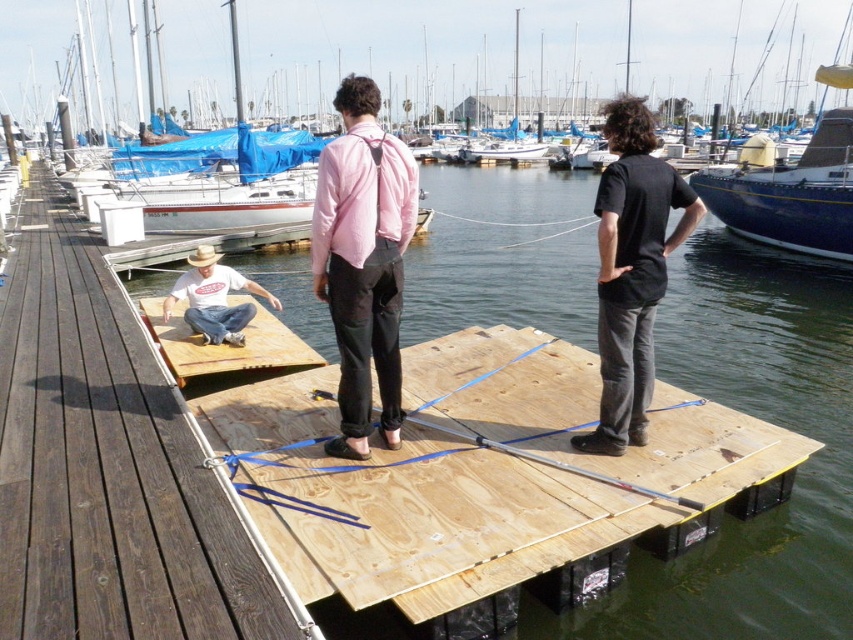
Question: Is blue tarpaulin boat at upper left to the left of wooden ramp at center from the viewer's perspective?

Choices:
 (A) no
 (B) yes

Answer: (B)

Question: Can you confirm if brown wooden dock at left is positioned below black cotton shirt at center?

Choices:
 (A) yes
 (B) no

Answer: (A)

Question: Which object appears closest to the camera in this image?

Choices:
 (A) wooden dock at center
 (B) blue tarpaulin boat at upper left

Answer: (A)

Question: Which object is closer to the camera taking this photo?

Choices:
 (A) blue tarpaulin boat at upper left
 (B) brown wooden dock at left
 (C) pink matte shirt at center

Answer: (B)

Question: Which point is closer to the camera?

Choices:
 (A) (341, 148)
 (B) (490, 177)

Answer: (A)

Question: Can you confirm if wooden dock at center is bigger than blue tarpaulin boat at upper left?

Choices:
 (A) yes
 (B) no

Answer: (B)